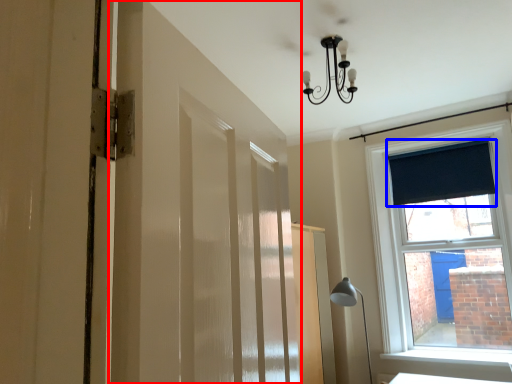
Question: Which object is closer to the camera taking this photo, barn door (highlighted by a red box) or curtain (highlighted by a blue box)?

Choices:
 (A) barn door
 (B) curtain

Answer: (A)